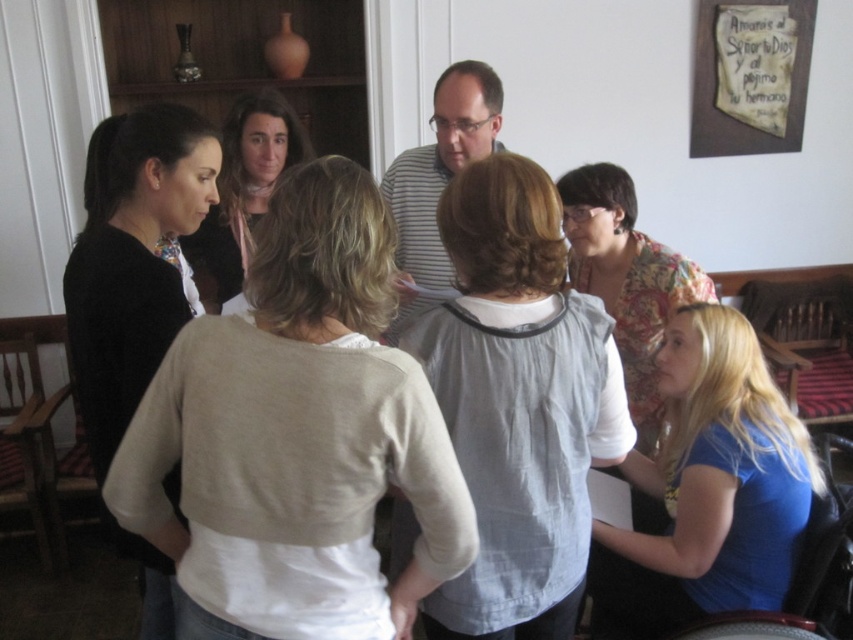
Question: Does blue cotton shirt at lower right have a lesser width compared to smooth beige blouse at center?

Choices:
 (A) yes
 (B) no

Answer: (A)

Question: Among these points, which one is farthest from the camera?

Choices:
 (A) (491, 513)
 (B) (740, 560)
 (C) (393, 380)

Answer: (B)

Question: Which point is farther to the camera?

Choices:
 (A) (544, 410)
 (B) (219, 282)

Answer: (B)

Question: Can you confirm if light beige sweater at center is positioned below blue cotton shirt at lower right?

Choices:
 (A) yes
 (B) no

Answer: (B)

Question: From the image, what is the correct spatial relationship of blue cotton shirt at lower right in relation to black matte sweater at left?

Choices:
 (A) below
 (B) above

Answer: (A)

Question: Which is nearer to the light gray cotton blouse at center?

Choices:
 (A) floral fabric blouse at center
 (B) black matte sweater at left
 (C) light beige sweater at center
 (D) blue cotton shirt at lower right

Answer: (C)